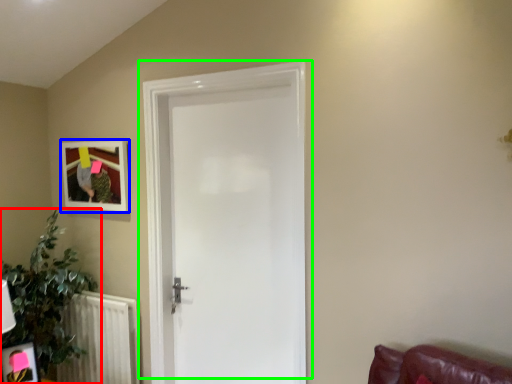
Question: Estimate the real-world distances between objects in this image. Which object is closer to houseplant (highlighted by a red box), picture frame (highlighted by a blue box) or door (highlighted by a green box)?

Choices:
 (A) picture frame
 (B) door

Answer: (A)